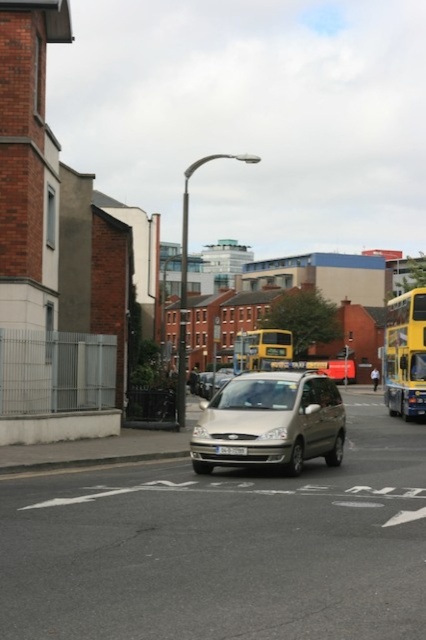
Who is more forward, (391, 298) or (287, 332)?

Positioned in front is point (287, 332).

Does yellow metallic bus at right have a lesser width compared to yellow metallic bus at center?

In fact, yellow metallic bus at right might be wider than yellow metallic bus at center.

Between point (411, 384) and point (276, 333), which one is positioned in front?

Positioned in front is point (411, 384).

The height and width of the screenshot is (640, 426). Identify the location of yellow metallic bus at right. 405,355.

Looking at this image, between yellow metallic bus at center and white plastic license plate at center, which one has less height?

Standing shorter between the two is white plastic license plate at center.

Between point (282, 344) and point (244, 451), which one is positioned behind?

The point (282, 344) is more distant.

Find the location of `yellow metallic bus at center`. yellow metallic bus at center is located at coordinates (x=261, y=348).

Can you confirm if satin gold minivan at center is positioned to the right of yellow metallic bus at center?

Incorrect, satin gold minivan at center is not on the right side of yellow metallic bus at center.

Does satin gold minivan at center have a larger size compared to yellow metallic bus at center?

Incorrect, satin gold minivan at center is not larger than yellow metallic bus at center.

Does point (299, 372) lie in front of point (276, 352)?

Yes, it is in front of point (276, 352).

The height and width of the screenshot is (640, 426). Find the location of `satin gold minivan at center`. satin gold minivan at center is located at coordinates (270, 420).